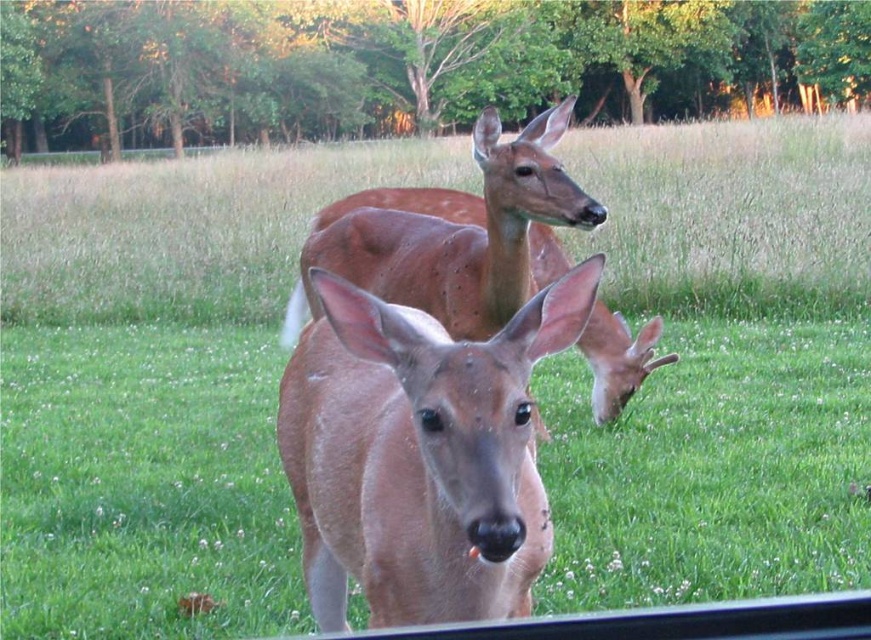
Question: Is matte brown deer at center positioned before brown matte/deer at center?

Choices:
 (A) yes
 (B) no

Answer: (A)

Question: Which object is farther from the camera taking this photo?

Choices:
 (A) matte brown deer at center
 (B) brown matte/deer at center

Answer: (B)

Question: Observing the image, what is the correct spatial positioning of matte brown deer at center in reference to brown matte/deer at center?

Choices:
 (A) above
 (B) below

Answer: (B)

Question: Which point is closer to the camera?

Choices:
 (A) brown matte/deer at center
 (B) matte brown deer at center

Answer: (B)

Question: Is matte brown deer at center to the right of brown matte/deer at center from the viewer's perspective?

Choices:
 (A) no
 (B) yes

Answer: (A)